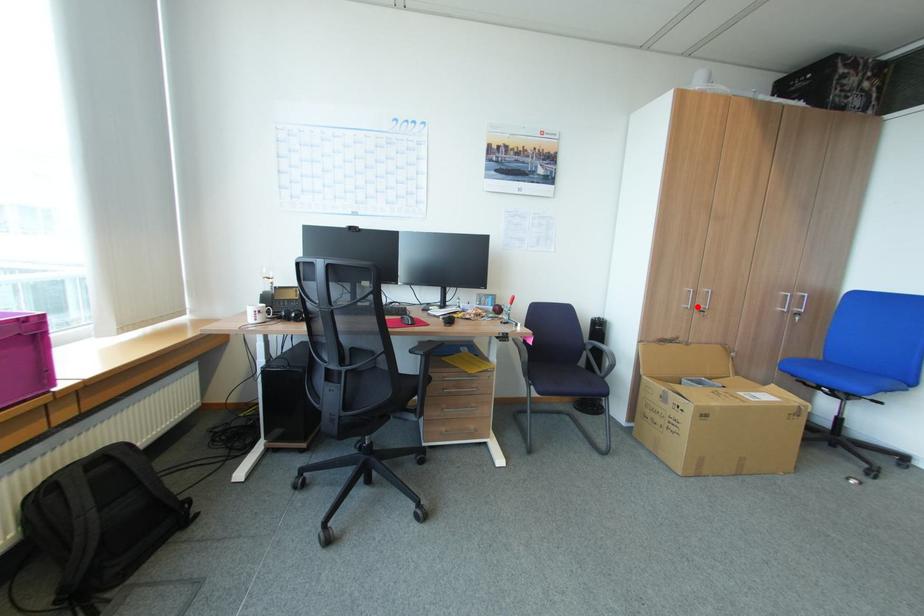
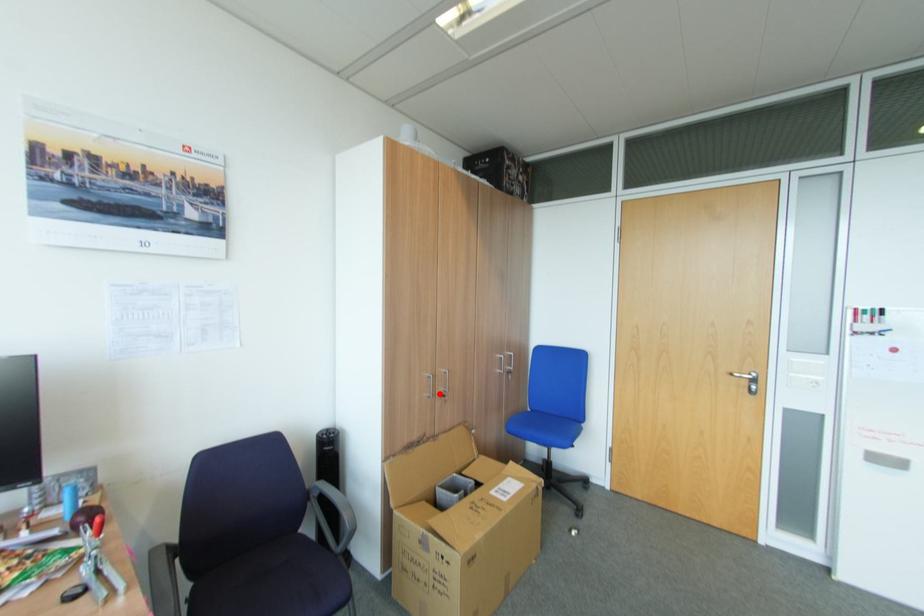
I am providing you with two images of the same scene from different viewpoints. A red point is marked on the first image and another point is marked on the second image. Do the highlighted points in image1 and image2 indicate the same real-world spot?

Yes